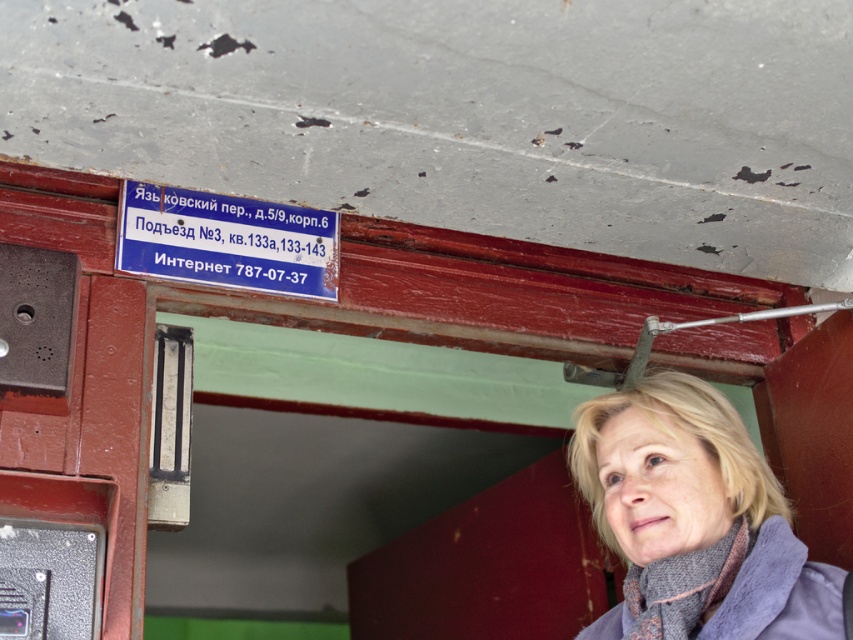
Between blue plastic sign at upper center and black textured phone box at lower left, which one appears on the left side from the viewer's perspective?

Positioned to the left is black textured phone box at lower left.

Between blue plastic sign at upper center and black textured phone box at lower left, which one has less height?

black textured phone box at lower left

What do you see at coordinates (227, 241) in the screenshot? I see `blue plastic sign at upper center` at bounding box center [227, 241].

The height and width of the screenshot is (640, 853). I want to click on blue plastic sign at upper center, so click(x=227, y=241).

Is blonde hair at upper right above blue plastic sign at upper center?

Actually, blonde hair at upper right is below blue plastic sign at upper center.

Between blonde hair at upper right and blue plastic sign at upper center, which one is positioned higher?

Positioned higher is blue plastic sign at upper center.

Is point (654, 390) positioned after point (206, 241)?

No.

Locate an element on the screen. blonde hair at upper right is located at coordinates (695, 520).

Can you confirm if blonde hair at upper right is positioned below black textured phone box at lower left?

Incorrect, blonde hair at upper right is not positioned below black textured phone box at lower left.

Consider the image. Between blonde hair at upper right and black textured phone box at lower left, which one appears on the left side from the viewer's perspective?

Positioned to the left is black textured phone box at lower left.

At what (x,y) coordinates should I click in order to perform the action: click on blonde hair at upper right. Please return your answer as a coordinate pair (x, y). Looking at the image, I should click on (695, 520).